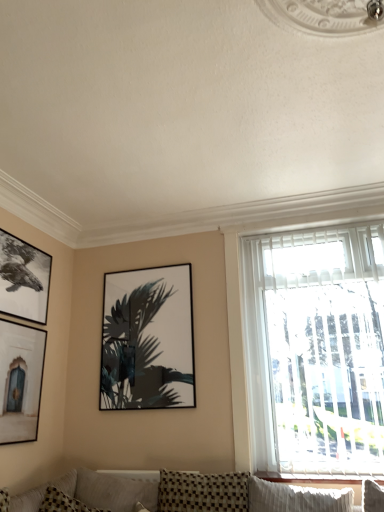
This screenshot has height=512, width=384. Describe the element at coordinates (318, 478) in the screenshot. I see `white wood window sill at lower right` at that location.

Describe the element at coordinates (20, 380) in the screenshot. I see `matte black picture frame at left, the 2th picture frame viewed from the left` at that location.

Find the location of a particular element. The width and height of the screenshot is (384, 512). white textured blinds at right is located at coordinates (314, 349).

In order to face white textured blinds at right, should I rotate leftwards or rightwards?

Turn right approximately 17.254 degrees to face it.

Where is `white wood window sill at lower right`? This screenshot has height=512, width=384. white wood window sill at lower right is located at coordinates (318, 478).

Is white wood window sill at lower right beside white textured blinds at right?

white wood window sill at lower right and white textured blinds at right are clearly separated.

Considering their positions, is white wood window sill at lower right located in front of or behind white textured blinds at right?

white wood window sill at lower right is in front of white textured blinds at right.

Can you confirm if white wood window sill at lower right is wider than white textured blinds at right?

Yes, white wood window sill at lower right is wider than white textured blinds at right.

How distant is white wood window sill at lower right from white textured blinds at right?

28.08 inches.

Can you confirm if black matte picture frame at upper left, the 1th picture frame when ordered from left to right, is taller than checkered fabric pillow at lower left?

Yes.

From the picture: Between black matte picture frame at upper left, the third picture frame positioned from the right, and checkered fabric pillow at lower left, which one appears on the left side from the viewer's perspective?

Positioned to the left is black matte picture frame at upper left, the third picture frame positioned from the right.

From a real-world perspective, is black matte picture frame at upper left, the third picture frame positioned from the right, physically located above or below checkered fabric pillow at lower left?

From a real-world perspective, black matte picture frame at upper left, the third picture frame positioned from the right, is physically above checkered fabric pillow at lower left.

Considering the sizes of objects white wood window sill at lower right and black matte picture frame at upper left, the 1th picture frame when ordered from left to right, in the image provided, who is thinner, white wood window sill at lower right or black matte picture frame at upper left, the 1th picture frame when ordered from left to right,?

black matte picture frame at upper left, the 1th picture frame when ordered from left to right, is thinner.

Based on the photo, is white wood window sill at lower right touching black matte picture frame at upper left, the third picture frame positioned from the right?

There is a gap between white wood window sill at lower right and black matte picture frame at upper left, the third picture frame positioned from the right.

Is white wood window sill at lower right in front of or behind black matte picture frame at upper left, the third picture frame positioned from the right, in the image?

Clearly, white wood window sill at lower right is in front of black matte picture frame at upper left, the third picture frame positioned from the right.

From the image's perspective, which is above, white wood window sill at lower right or black matte picture frame at upper left, the third picture frame positioned from the right?

black matte picture frame at upper left, the third picture frame positioned from the right.

From their relative heights in the image, would you say black matte picture frame at upper left, the third picture frame positioned from the right, is taller or shorter than white textured blinds at right?

In the image, black matte picture frame at upper left, the third picture frame positioned from the right, appears to be shorter than white textured blinds at right.

Can you confirm if black matte picture frame at upper left, the 1th picture frame when ordered from left to right, is thinner than white textured blinds at right?

Indeed, black matte picture frame at upper left, the 1th picture frame when ordered from left to right, has a lesser width compared to white textured blinds at right.

Are black matte picture frame at upper left, the third picture frame positioned from the right, and white textured blinds at right far apart?

Yes, black matte picture frame at upper left, the third picture frame positioned from the right, and white textured blinds at right are located far from each other.

Is point (28, 284) closer to camera compared to point (358, 362)?

No, (28, 284) is behind (358, 362).

Which is more to the left, matte black picture frame at left, which is the 2th picture frame from right to left, or matte black picture frame at center, which is the third picture frame in left-to-right order?

From the viewer's perspective, matte black picture frame at left, which is the 2th picture frame from right to left, appears more on the left side.

Based on the photo, can we say matte black picture frame at left, which is the 2th picture frame from right to left, lies outside matte black picture frame at center, which is the third picture frame in left-to-right order?

Indeed, matte black picture frame at left, which is the 2th picture frame from right to left, is completely outside matte black picture frame at center, which is the third picture frame in left-to-right order.

Locate an element on the screen. Image resolution: width=384 pixels, height=512 pixels. picture frame that is the 2nd one when counting forward from the matte black picture frame at center, arranged as the 1th picture frame when viewed from the right is located at coordinates (20, 380).

Is point (12, 396) more distant than point (123, 312)?

No, it is not.

Which object is positioned more to the left, black matte picture frame at upper left, the third picture frame positioned from the right, or matte black picture frame at left, the 2th picture frame viewed from the left?

black matte picture frame at upper left, the third picture frame positioned from the right.

The height and width of the screenshot is (512, 384). What are the coordinates of `picture frame on the left of matte black picture frame at left, the 2th picture frame viewed from the left` in the screenshot? It's located at (23, 279).

Between black matte picture frame at upper left, the 1th picture frame when ordered from left to right, and matte black picture frame at left, which is the 2th picture frame from right to left, which one has smaller size?

Smaller between the two is matte black picture frame at left, which is the 2th picture frame from right to left.

Can you confirm if black matte picture frame at upper left, the third picture frame positioned from the right, is taller than matte black picture frame at left, the 2th picture frame viewed from the left?

In fact, black matte picture frame at upper left, the third picture frame positioned from the right, may be shorter than matte black picture frame at left, the 2th picture frame viewed from the left.

Can you tell me how much white textured blinds at right and checkered fabric pillow at lower left differ in facing direction?

The angular difference between white textured blinds at right and checkered fabric pillow at lower left is 86.3 degrees.

Which object is wider, white textured blinds at right or checkered fabric pillow at lower left?

checkered fabric pillow at lower left.

Is white textured blinds at right positioned beyond the bounds of checkered fabric pillow at lower left?

Yes.

Considering the relative sizes of white textured blinds at right and checkered fabric pillow at lower left in the image provided, is white textured blinds at right taller than checkered fabric pillow at lower left?

Indeed, white textured blinds at right has a greater height compared to checkered fabric pillow at lower left.

What are the coordinates of `window sill beneath the white textured blinds at right (from a real-world perspective)` in the screenshot? It's located at (318, 478).

What are the coordinates of `the 2nd picture frame behind the checkered fabric pillow at lower left` in the screenshot? It's located at (23, 279).

Estimate the real-world distances between objects in this image. Which object is further from black matte picture frame at upper left, the 1th picture frame when ordered from left to right, matte black picture frame at left, the 2th picture frame viewed from the left, or checkered fabric pillow at lower left?

Based on the image, checkered fabric pillow at lower left appears to be further to black matte picture frame at upper left, the 1th picture frame when ordered from left to right.

Which object lies nearer to the anchor point matte black picture frame at left, the 2th picture frame viewed from the left, checkered fabric pillow at lower left or white wood window sill at lower right?

Answer: Among the two, checkered fabric pillow at lower left is located nearer to matte black picture frame at left, the 2th picture frame viewed from the left.

Based on their spatial positions, is matte black picture frame at left, which is the 2th picture frame from right to left, or white textured blinds at right further from matte black picture frame at center, arranged as the 1th picture frame when viewed from the right?

white textured blinds at right lies further to matte black picture frame at center, arranged as the 1th picture frame when viewed from the right, than the other object.

In the scene shown: Looking at the image, which one is located further to matte black picture frame at center, which is the third picture frame in left-to-right order, white textured blinds at right or matte black picture frame at left, the 2th picture frame viewed from the left?

Among the two, white textured blinds at right is located further to matte black picture frame at center, which is the third picture frame in left-to-right order.

When comparing their distances from black matte picture frame at upper left, the third picture frame positioned from the right, does white wood window sill at lower right or matte black picture frame at left, which is the 2th picture frame from right to left, seem closer?

Based on the image, matte black picture frame at left, which is the 2th picture frame from right to left, appears to be nearer to black matte picture frame at upper left, the third picture frame positioned from the right.

Based on their spatial positions, is matte black picture frame at left, which is the 2th picture frame from right to left, or matte black picture frame at center, arranged as the 1th picture frame when viewed from the right, further from black matte picture frame at upper left, the 1th picture frame when ordered from left to right?

Based on the image, matte black picture frame at center, arranged as the 1th picture frame when viewed from the right, appears to be further to black matte picture frame at upper left, the 1th picture frame when ordered from left to right.

In the scene shown: When comparing their distances from white textured blinds at right, does matte black picture frame at left, which is the 2th picture frame from right to left, or white wood window sill at lower right seem further?

matte black picture frame at left, which is the 2th picture frame from right to left, is further to white textured blinds at right.

When comparing their distances from white wood window sill at lower right, does matte black picture frame at center, which is the third picture frame in left-to-right order, or matte black picture frame at left, which is the 2th picture frame from right to left, seem further?

matte black picture frame at left, which is the 2th picture frame from right to left, is further to white wood window sill at lower right.

Where is `picture frame between matte black picture frame at center, which is the third picture frame in left-to-right order, and checkered fabric pillow at lower left in the up-down direction`? picture frame between matte black picture frame at center, which is the third picture frame in left-to-right order, and checkered fabric pillow at lower left in the up-down direction is located at coordinates (20, 380).

You are a GUI agent. You are given a task and a screenshot of the screen. Output one action in this format:
    pyautogui.click(x=<x>, y=<y>)
    Task: Click on the picture frame between checkered fabric pillow at lower left and white wood window sill at lower right
    Image resolution: width=384 pixels, height=512 pixels.
    Given the screenshot: What is the action you would take?
    pyautogui.click(x=148, y=339)

At what (x,y) coordinates should I click in order to perform the action: click on pillow between black matte picture frame at upper left, the third picture frame positioned from the right, and white wood window sill at lower right, in the horizontal direction. Please return your answer as a coordinate pair (x, y). Looking at the image, I should click on [43, 493].

The image size is (384, 512). Identify the location of window sill between black matte picture frame at upper left, the third picture frame positioned from the right, and white textured blinds at right from left to right. (318, 478).